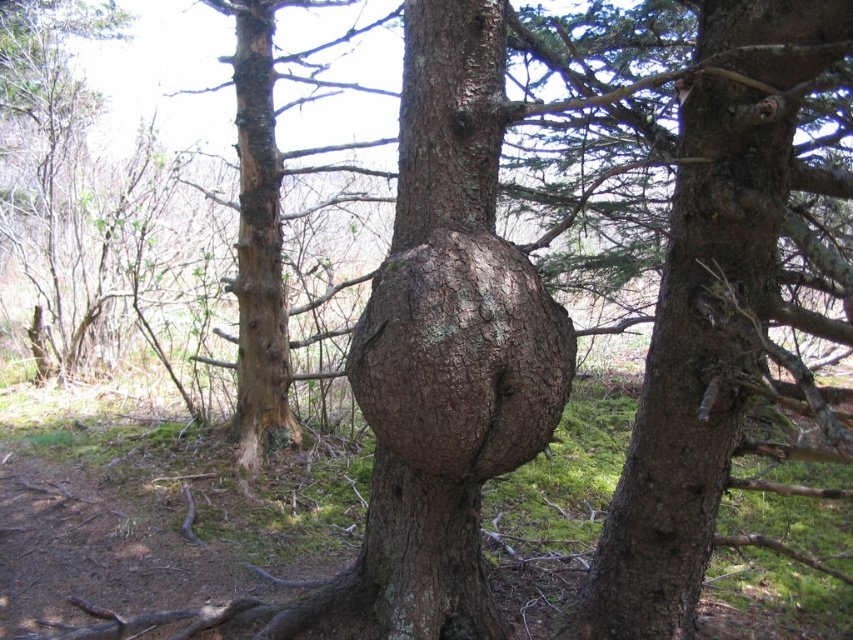
From the picture: Is brown rough bark at center wider than brown rough bark tree trunk at left?

Indeed, brown rough bark at center has a greater width compared to brown rough bark tree trunk at left.

Does brown rough bark at center appear on the right side of brown rough bark tree trunk at left?

→ Indeed, brown rough bark at center is positioned on the right side of brown rough bark tree trunk at left.

Between point (456, 461) and point (262, 16), which one is positioned in front?

Point (456, 461) is more forward.

I want to click on brown rough bark at center, so click(x=460, y=356).